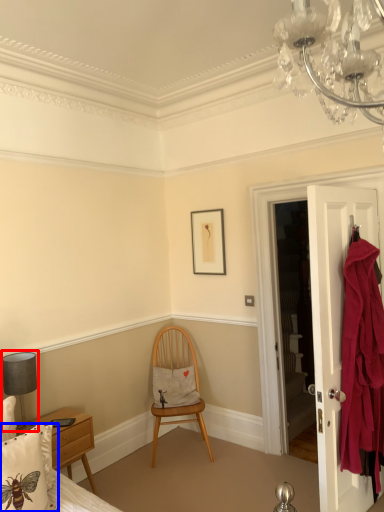
Question: Which object is further to the camera taking this photo, lamp (highlighted by a red box) or pillow (highlighted by a blue box)?

Choices:
 (A) lamp
 (B) pillow

Answer: (A)